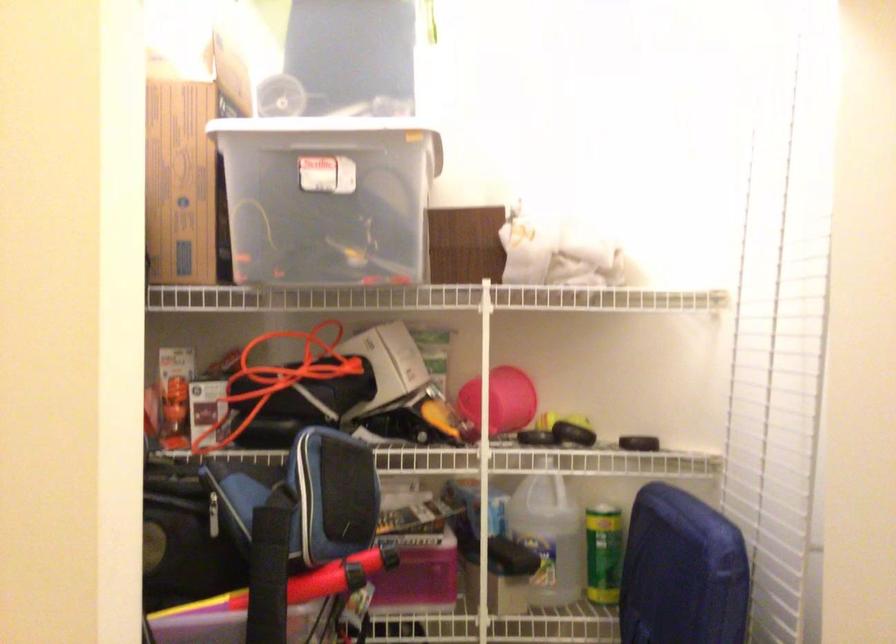
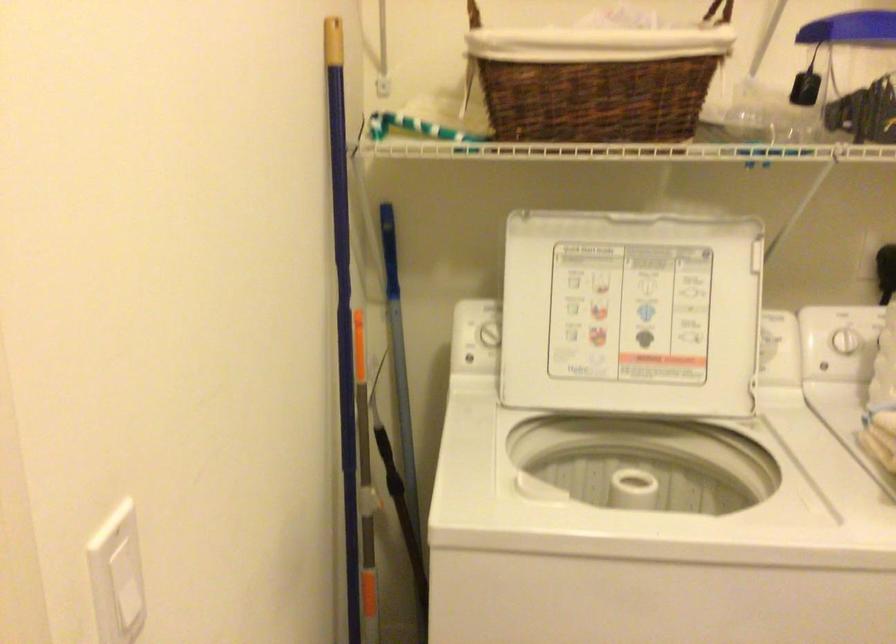
The first image is from the beginning of the video and the second image is from the end. How did the camera likely rotate when shooting the video?

The camera's rotation is toward left-down.